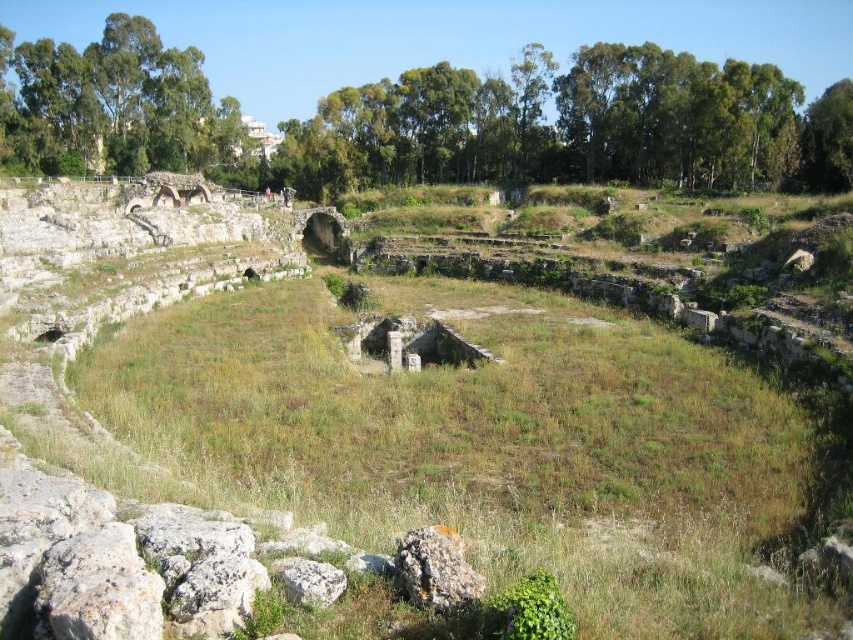
Between rusty metallic rock at center and white rough stone at center, which one is positioned lower?

white rough stone at center

Is rusty metallic rock at center positioned in front of white rough stone at center?

No, rusty metallic rock at center is behind white rough stone at center.

Measure the distance between rusty metallic rock at center and camera.

rusty metallic rock at center and camera are 38.49 meters apart from each other.

Locate an element on the screen. rusty metallic rock at center is located at coordinates (434, 568).

Looking at this image, which is below, green grass at center or white rough stone at center?

Positioned lower is white rough stone at center.

At what (x,y) coordinates should I click in order to perform the action: click on green grass at center. Please return your answer as a coordinate pair (x, y). Looking at the image, I should click on (355, 435).

Does green grass at center have a lesser width compared to rusty metallic rock at center?

In fact, green grass at center might be wider than rusty metallic rock at center.

Is point (57, 481) closer to camera compared to point (431, 602)?

That is False.

At what (x,y) coordinates should I click in order to perform the action: click on green grass at center. Please return your answer as a coordinate pair (x, y). This screenshot has width=853, height=640. Looking at the image, I should click on (355, 435).